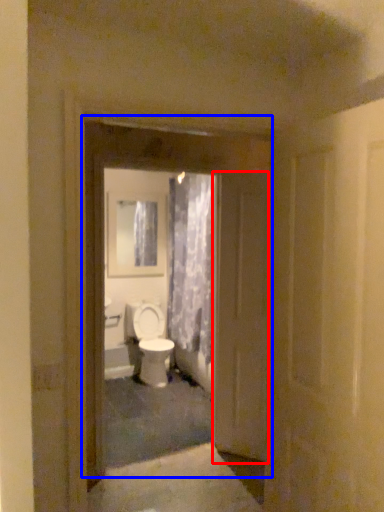
Question: Which object appears farthest to the camera in this image, door (highlighted by a red box) or door (highlighted by a blue box)?

Choices:
 (A) door
 (B) door

Answer: (A)